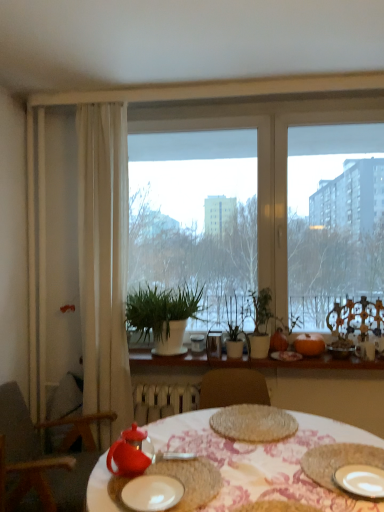
Identify the location of vacant space that is in between white matte plate at center, the 2th plate viewed from the right, and matte red teapot at lower center, the first tableware viewed from the front. (146, 482).